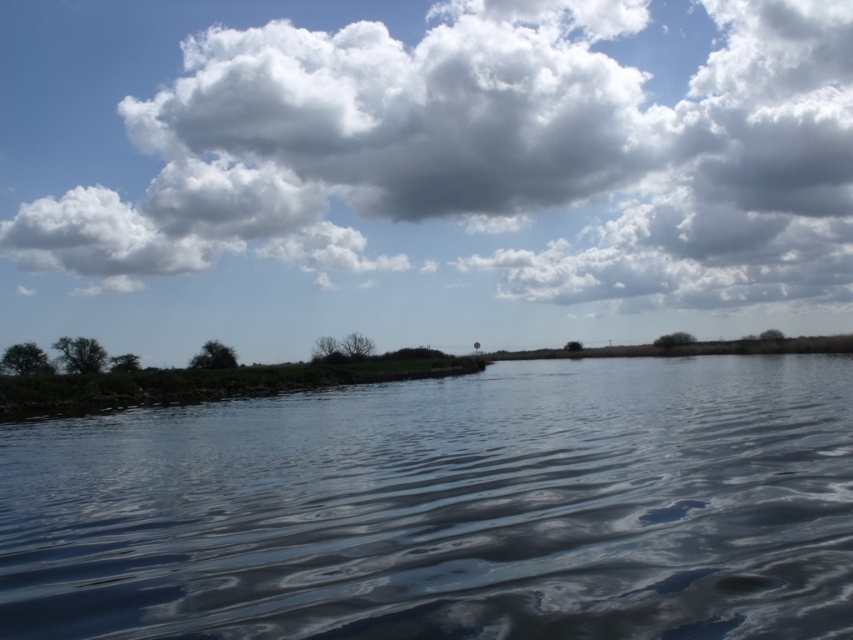
You are standing at the edge of the water in the serene scene. You see two points marked on the image. The first point is at coordinates point (428, 552), and the second is at point (801, 76). Which point is closer to you?

Point (428, 552) is in front of point (801, 76), so the first point is closer to you.

You are standing at the edge of the water and want to locate the glossy water at center. According to the scene description, where exactly would you find it?

The glossy water at center is located at the 2D coordinates point (447,508).

In the scene shown: You are standing on the shore looking at the scene. Which object, the glossy water at center or the white fluffy cloud at upper center, is closer to you?

The glossy water at center is closer to you because it is positioned in front of the white fluffy cloud at upper center.